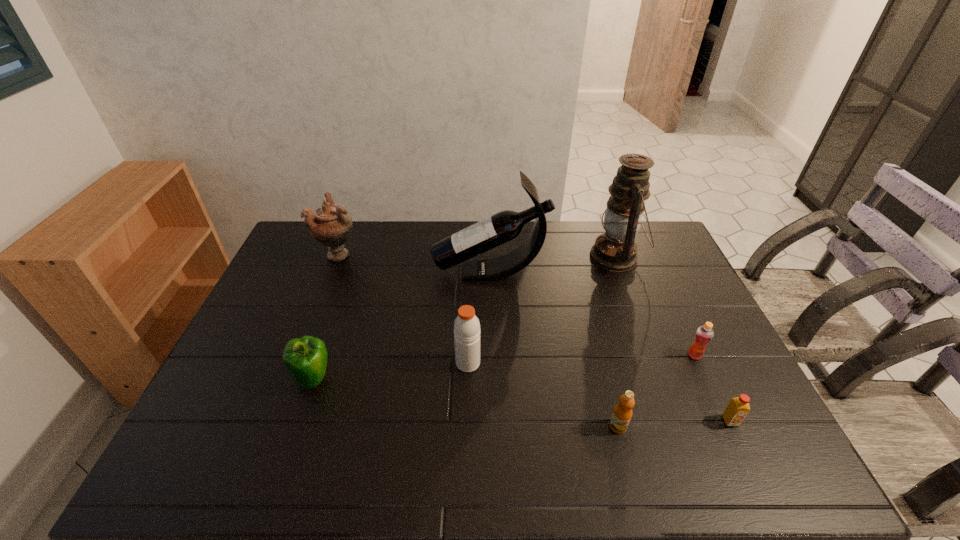
At what (x,y) coordinates should I click in order to perform the action: click on free space that is in between the urn and the shortest object. Please return your answer as a coordinate pair (x, y). The width and height of the screenshot is (960, 540). Looking at the image, I should click on (535, 338).

I want to click on vacant space in between the shaker and the wine bottle, so click(x=479, y=318).

Locate an element on the screen. free space that is in between the farthest orange juice and the urn is located at coordinates 517,305.

Image resolution: width=960 pixels, height=540 pixels. In order to click on free space that is in between the shaker and the urn in this screenshot , I will do `click(404, 308)`.

Where is `empty space between the shortest orange juice and the farthest orange juice`? empty space between the shortest orange juice and the farthest orange juice is located at coordinates (712, 388).

Find the location of a particular element. This screenshot has width=960, height=540. empty space between the wine bottle and the farthest orange juice is located at coordinates (592, 314).

You are a GUI agent. You are given a task and a screenshot of the screen. Output one action in this format:
    pyautogui.click(x=<x>, y=<y>)
    Task: Click on the free point between the shaker and the shortest orange juice
    This screenshot has width=960, height=540.
    Given the screenshot: What is the action you would take?
    pyautogui.click(x=599, y=392)

Find the location of a particular element. free spot between the wine bottle and the sixth object from left to right is located at coordinates (553, 265).

Locate an element on the screen. unoccupied position between the shaker and the wine bottle is located at coordinates (479, 318).

What are the coordinates of `object that is the third closest one to the leftmost orange juice` in the screenshot? It's located at (467, 332).